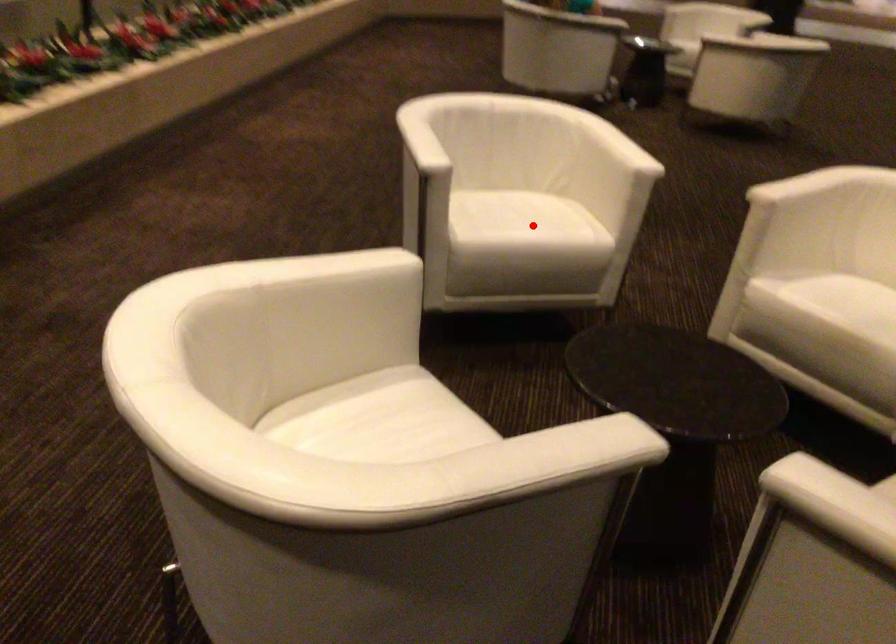
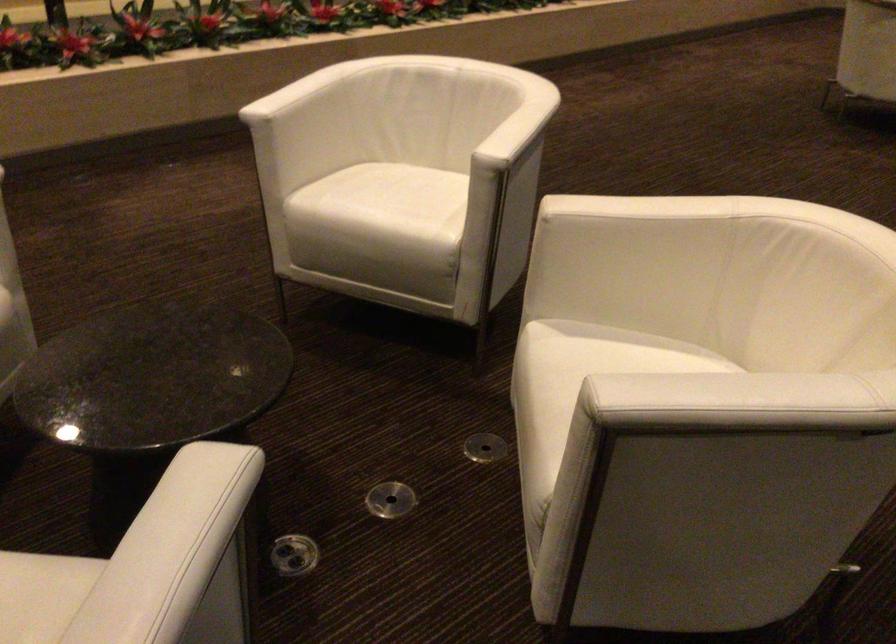
The point at the highlighted location is marked in the first image. Where is the corresponding point in the second image?

(383, 205)